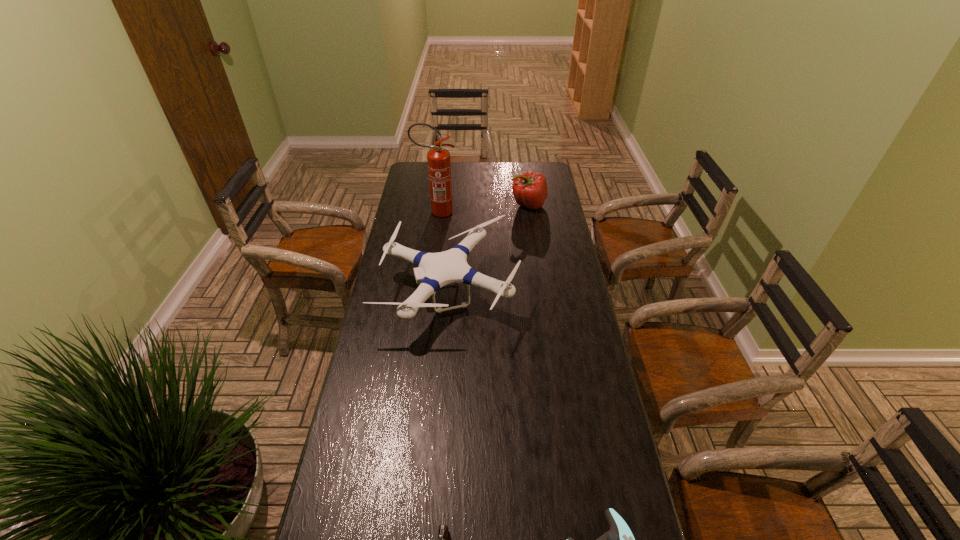
This screenshot has width=960, height=540. I want to click on free location at the right edge of the desktop, so click(559, 412).

Find the location of a particular element. This screenshot has width=960, height=540. vacant space at the far left corner is located at coordinates (428, 182).

Find the location of `free point at the far right corner`. free point at the far right corner is located at coordinates (534, 163).

The width and height of the screenshot is (960, 540). Find the location of `vacant space in between the third farthest object and the bell pepper`. vacant space in between the third farthest object and the bell pepper is located at coordinates (490, 248).

The height and width of the screenshot is (540, 960). What are the coordinates of `free space between the drone and the fire extinguisher` in the screenshot? It's located at (444, 252).

Locate which object ranks second in proximity to the shortest object. Please provide its 2D coordinates. Your answer should be formatted as a tuple, i.e. [(x, y)], where the tuple contains the x and y coordinates of a point satisfying the conditions above.

[(435, 270)]

In order to click on object that is the second closest one to the bell pepper in this screenshot , I will do `click(439, 164)`.

Where is `free location that satisfies the following two spatial constraints: 1. from the nozzle of the tallest object; 2. on the left side of the drone`? The width and height of the screenshot is (960, 540). free location that satisfies the following two spatial constraints: 1. from the nozzle of the tallest object; 2. on the left side of the drone is located at coordinates (426, 291).

Find the location of a particular element. The image size is (960, 540). free space that satisfies the following two spatial constraints: 1. from the nozzle of the fire extinguisher; 2. on the back side of the third nearest object is located at coordinates (426, 291).

Locate an element on the screen. free spot that satisfies the following two spatial constraints: 1. from the nozzle of the drone; 2. on the right side of the tallest object is located at coordinates (426, 291).